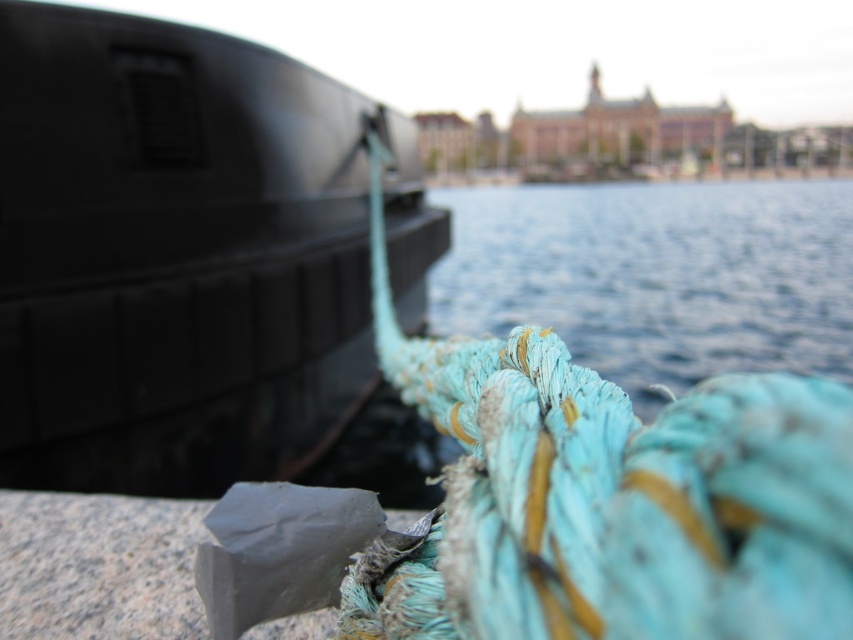
Consider the image. You are a dock worker who needs to secure a new boat to the dock. The existing boat, the matte black boat at left, is already tied up. You have a new boat that is 5 meters long. Can you safely dock your new boat next to the existing one without overlapping with the blue fabric water at center? Explain your reasoning.

The distance between the matte black boat at left and the blue fabric water at center is 8.37 meters. Since your new boat is 5 meters long, there is enough space between them to safely dock without overlapping. The remaining space would be 3.37 meters, which is sufficient for maneuvering and safety.

You are a photographer trying to capture the matte black boat at left. You want to position your camera at a specific coordinate to ensure the boat is centered in your shot. What are the coordinates you should aim for?

The coordinates to center the matte black boat at left would be at point 0.395 on the x axis and 0.217 on the y axis, as that is where the boat is located.

You are standing on a pier and see the matte black boat at left and the blue fabric water at center. Which object is positioned lower in the scene?

The matte black boat at left is positioned below the blue fabric water at center, so it is lower in the scene.